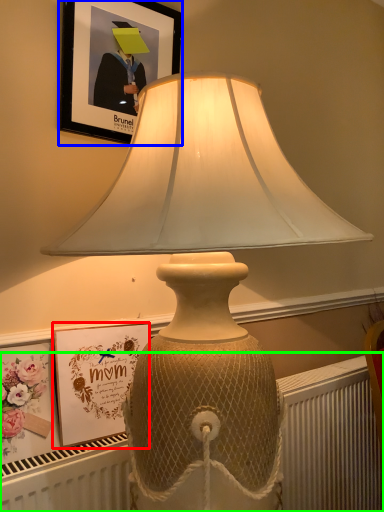
Question: Considering the real-world distances, which object is farthest from picture frame (highlighted by a red box)? picture frame (highlighted by a blue box) or radiator (highlighted by a green box)?

Choices:
 (A) picture frame
 (B) radiator

Answer: (B)